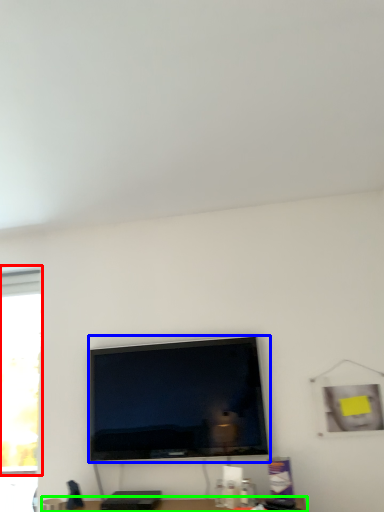
Question: Estimate the real-world distances between objects in this image. Which object is closer to window (highlighted by a red box), television (highlighted by a blue box) or furniture (highlighted by a green box)?

Choices:
 (A) television
 (B) furniture

Answer: (A)